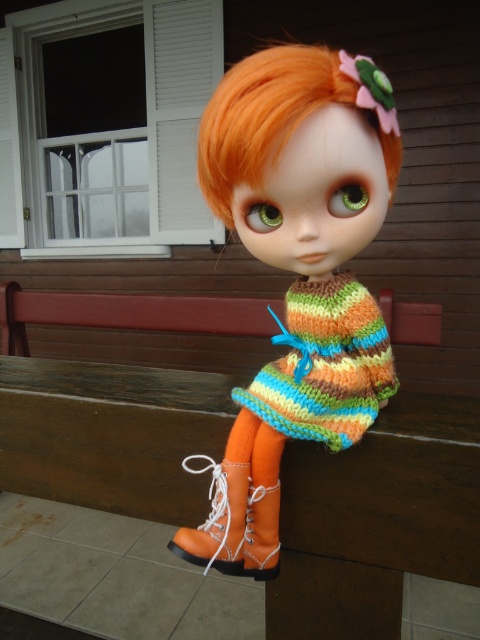
How much distance is there between brown wooden bench at center and orange leather boot at lower center?

brown wooden bench at center is 1.26 meters from orange leather boot at lower center.

Who is positioned more to the right, brown wooden bench at center or orange leather boot at lower center?

orange leather boot at lower center is more to the right.

Locate an element on the screen. The height and width of the screenshot is (640, 480). brown wooden bench at center is located at coordinates (111, 435).

Is orange synthetic hair at center above orange leather boot at lower center?

Yes, orange synthetic hair at center is above orange leather boot at lower center.

Is point (387, 134) less distant than point (264, 529)?

Yes, point (387, 134) is in front of point (264, 529).

Is point (230, 136) closer to camera compared to point (248, 504)?

Yes, it is in front of point (248, 504).

The height and width of the screenshot is (640, 480). In order to click on orange synthetic hair at center in this screenshot , I will do `click(285, 113)`.

Can you confirm if brown wooden bench at center is shorter than orange synthetic hair at center?

In fact, brown wooden bench at center may be taller than orange synthetic hair at center.

Who is more forward, (478, 429) or (267, 102)?

Point (267, 102)

The image size is (480, 640). In order to click on brown wooden bench at center in this screenshot , I will do `click(111, 435)`.